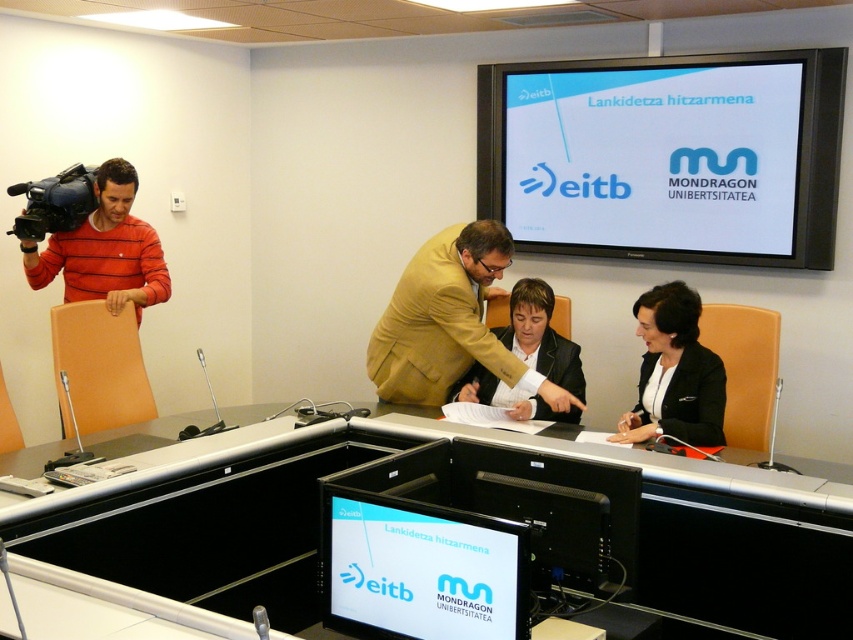
Question: Which object is the farthest from the striped cotton shirt at left?

Choices:
 (A) matte black video camera at left
 (B) matte black monitor at center
 (C) matte gold suit at center
 (D) smooth black table at center

Answer: (B)

Question: Can you confirm if matte black monitor at center is bigger than matte gold suit at center?

Choices:
 (A) yes
 (B) no

Answer: (B)

Question: Estimate the real-world distances between objects in this image. Which object is closer to the matte black suit at center?

Choices:
 (A) striped cotton shirt at left
 (B) white glossy projection screen at upper center
 (C) matte black monitor at center
 (D) matte gold suit at center

Answer: (D)

Question: Is the position of white glossy projection screen at upper center more distant than that of matte black suit at center?

Choices:
 (A) yes
 (B) no

Answer: (A)

Question: Which point appears farthest from the camera in this image?

Choices:
 (A) (640, 364)
 (B) (86, 225)

Answer: (B)

Question: Does striped cotton shirt at left have a lesser width compared to black glossy suit at center?

Choices:
 (A) no
 (B) yes

Answer: (A)